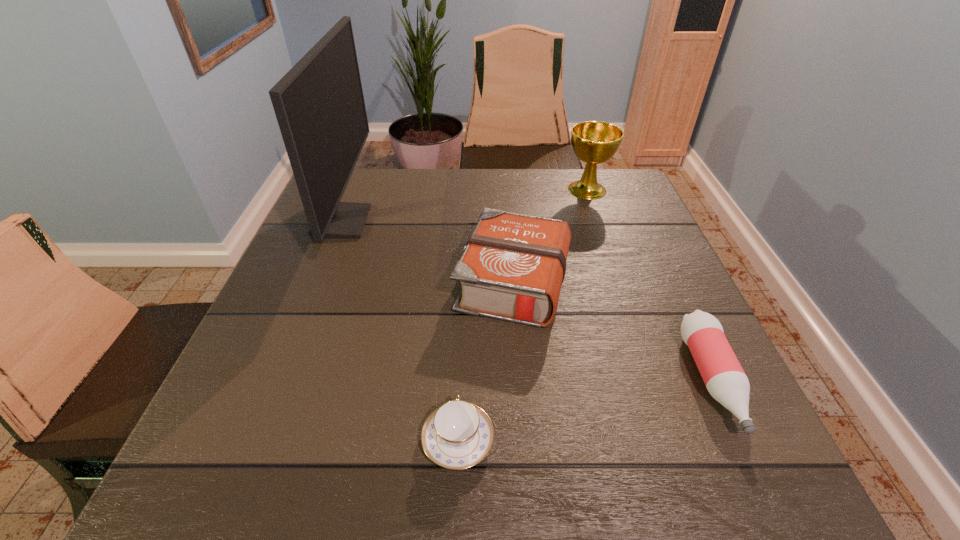
The image size is (960, 540). What are the coordinates of `vacant space at the near right corner of the desktop` in the screenshot? It's located at (753, 498).

The image size is (960, 540). I want to click on vacant area between the chalice and the computer monitor, so click(x=465, y=206).

This screenshot has height=540, width=960. Identify the location of free spot between the chalice and the leftmost object. (465, 206).

Identify the location of free space between the tallest object and the chalice. The width and height of the screenshot is (960, 540). (465, 206).

The width and height of the screenshot is (960, 540). What are the coordinates of `free space that is in between the fourth tallest object and the third tallest object` in the screenshot? It's located at (612, 331).

Identify the location of free space between the bottle and the Bible. The width and height of the screenshot is (960, 540). (612, 331).

Locate an element on the screen. The height and width of the screenshot is (540, 960). vacant space that is in between the computer monitor and the Bible is located at coordinates (427, 252).

What are the coordinates of `blank region between the Bible and the teacup` in the screenshot? It's located at (486, 361).

What are the coordinates of `object that stands as the closest to the bottle` in the screenshot? It's located at (512, 268).

Select which object is the second closest to the Bible. Please provide its 2D coordinates. Your answer should be formatted as a tuple, i.e. [(x, y)], where the tuple contains the x and y coordinates of a point satisfying the conditions above.

[(725, 380)]